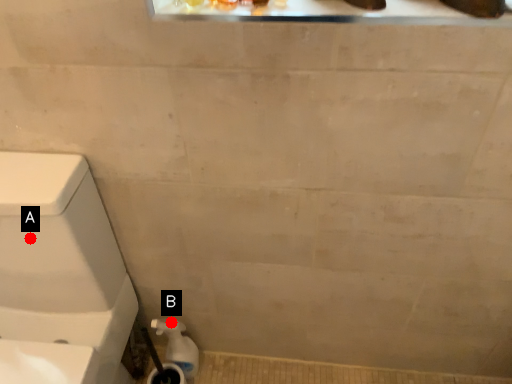
Question: Two points are circled on the image, labeled by A and B beside each circle. Which point appears closest to the camera in this image?

Choices:
 (A) A is closer
 (B) B is closer

Answer: (A)